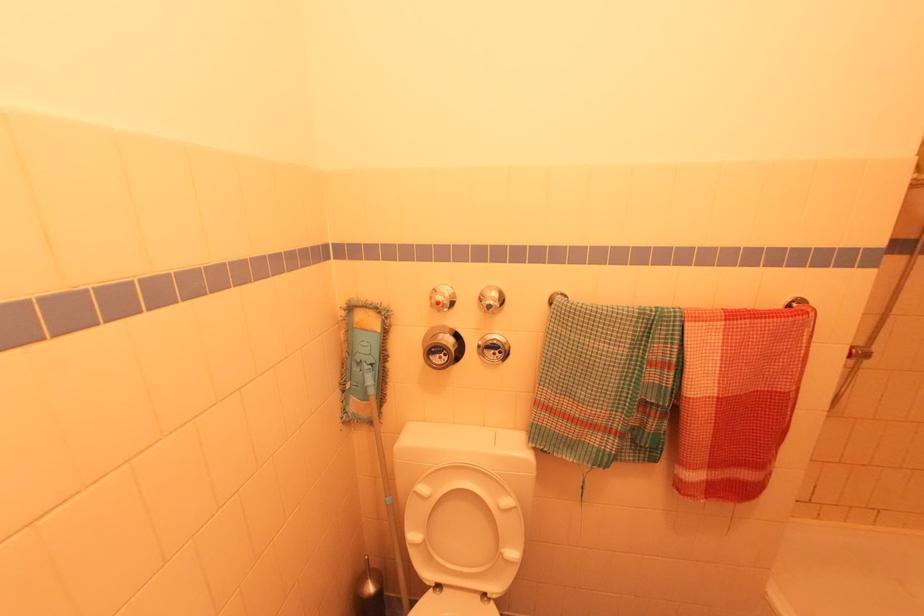
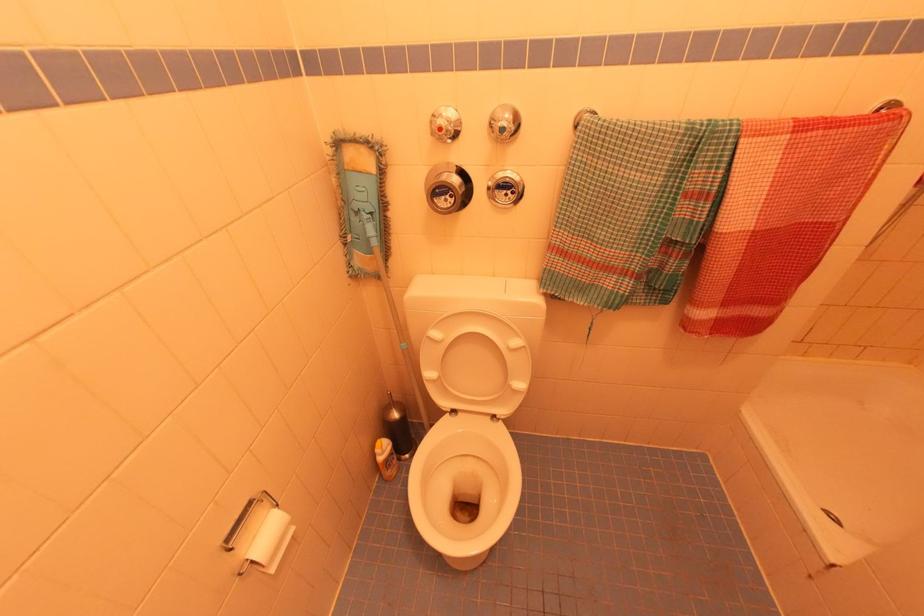
In the second image, find the point that corresponds to pixel 421 483 in the first image.

(433, 329)